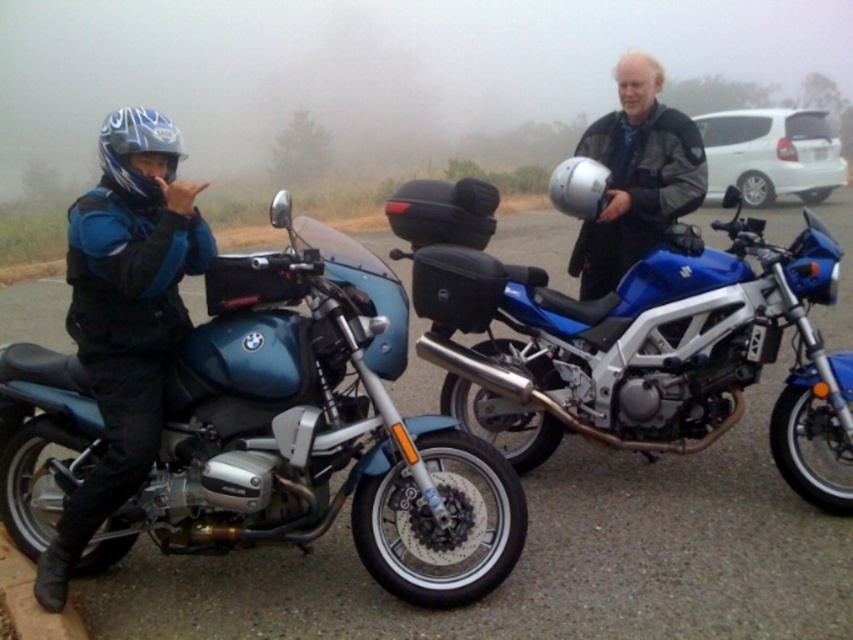
Which is more to the right, metallic blue motorcycle at left or matte blue motorcycle at left?

From the viewer's perspective, metallic blue motorcycle at left appears more on the right side.

At what (x,y) coordinates should I click in order to perform the action: click on metallic blue motorcycle at left. Please return your answer as a coordinate pair (x, y). The image size is (853, 640). Looking at the image, I should click on (316, 432).

This screenshot has width=853, height=640. Describe the element at coordinates (316, 432) in the screenshot. I see `metallic blue motorcycle at left` at that location.

Find the location of a particular element. The image size is (853, 640). metallic blue motorcycle at left is located at coordinates (316, 432).

Locate an element on the screen. The image size is (853, 640). blue metallic motorcycle at center is located at coordinates (627, 339).

Which is more to the right, blue metallic motorcycle at center or matte black helmet at center?

matte black helmet at center is more to the right.

Which is behind, point (467, 237) or point (659, 125)?

The point (659, 125) is behind.

The height and width of the screenshot is (640, 853). I want to click on blue metallic motorcycle at center, so click(627, 339).

Can you confirm if blue metallic motorcycle at center is wider than matte blue motorcycle at left?

Indeed, blue metallic motorcycle at center has a greater width compared to matte blue motorcycle at left.

Can you confirm if blue metallic motorcycle at center is thinner than matte blue motorcycle at left?

Incorrect, blue metallic motorcycle at center's width is not less than matte blue motorcycle at left's.

Describe the element at coordinates (627, 339) in the screenshot. I see `blue metallic motorcycle at center` at that location.

Identify the location of blue metallic motorcycle at center. This screenshot has height=640, width=853. (627, 339).